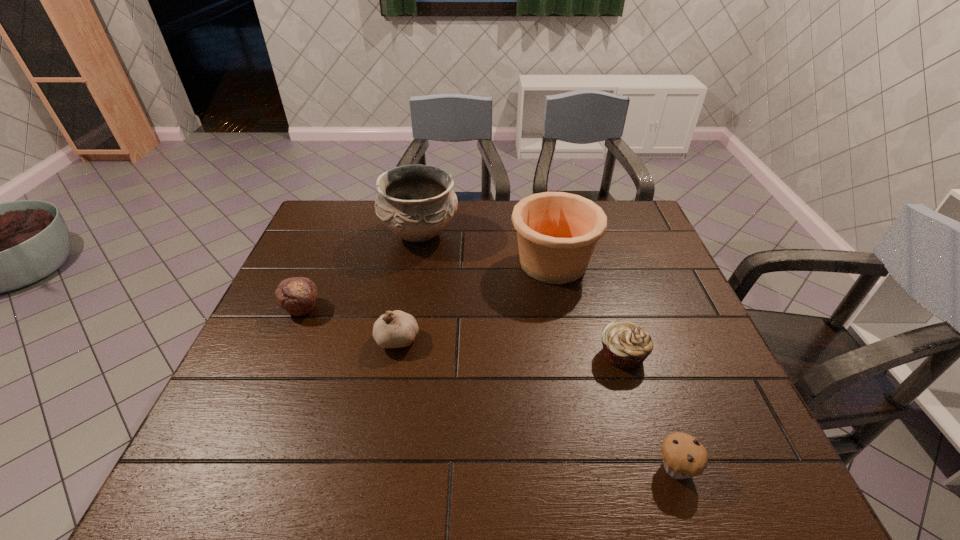
Locate an element on the screen. The height and width of the screenshot is (540, 960). vacant area between the leftmost object and the right pottery is located at coordinates (427, 286).

Identify the location of unoccupied area between the right pottery and the second farthest muffin. The image size is (960, 540). (588, 309).

Identify the location of unoccupied area between the farthest muffin and the garlic. This screenshot has width=960, height=540. (349, 323).

Select which object appears as the second closest to the nearest muffin. Please provide its 2D coordinates. Your answer should be formatted as a tuple, i.e. [(x, y)], where the tuple contains the x and y coordinates of a point satisfying the conditions above.

[(557, 232)]

The height and width of the screenshot is (540, 960). I want to click on object that stands as the third closest to the garlic, so click(x=416, y=202).

The height and width of the screenshot is (540, 960). Find the location of `the closest muffin relative to the shortest muffin`. the closest muffin relative to the shortest muffin is located at coordinates (626, 345).

At what (x,y) coordinates should I click in order to perform the action: click on the closest muffin to the fourth nearest object. Please return your answer as a coordinate pair (x, y). Looking at the image, I should click on (626, 345).

Identify the location of free point that satisfies the following two spatial constraints: 1. on the front side of the second nearest muffin; 2. on the left side of the right pottery. The width and height of the screenshot is (960, 540). (571, 355).

You are a GUI agent. You are given a task and a screenshot of the screen. Output one action in this format:
    pyautogui.click(x=<x>, y=<y>)
    Task: Click on the free spot that satisfies the following two spatial constraints: 1. on the back side of the farthest muffin; 2. on the right side of the left pottery
    Image resolution: width=960 pixels, height=540 pixels.
    Given the screenshot: What is the action you would take?
    pyautogui.click(x=334, y=233)

At what (x,y) coordinates should I click in order to perform the action: click on free region that satisfies the following two spatial constraints: 1. on the front side of the shortest muffin; 2. on the right side of the second nearest muffin. Please return your answer as a coordinate pair (x, y). Image resolution: width=960 pixels, height=540 pixels. Looking at the image, I should click on (657, 467).